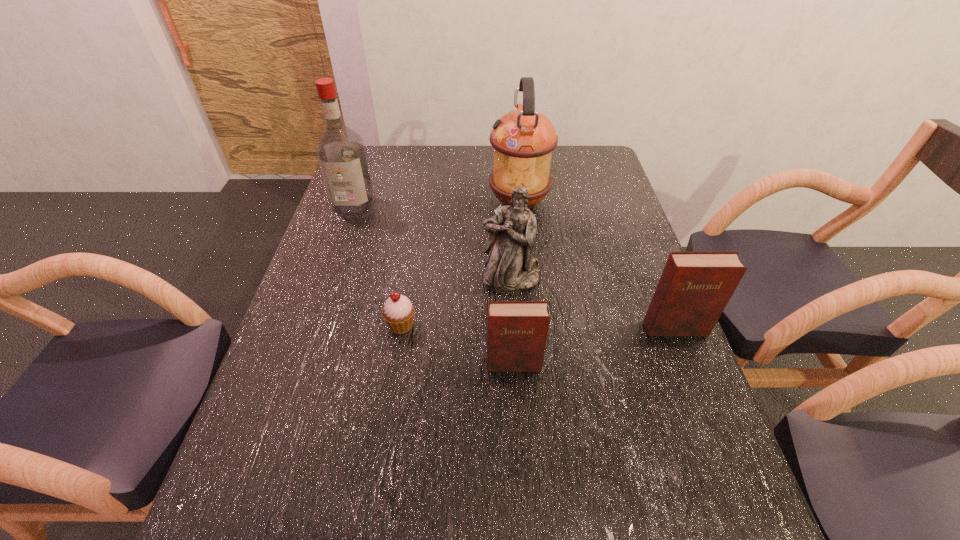
Locate an element on the screen. The image size is (960, 540). the nearer diary is located at coordinates (517, 331).

The image size is (960, 540). I want to click on the fifth tallest object, so click(517, 331).

The height and width of the screenshot is (540, 960). I want to click on the right diary, so click(695, 287).

Locate an element on the screen. the third shortest object is located at coordinates (695, 287).

At what (x,y) coordinates should I click in order to perform the action: click on oil lamp. Please return your answer as a coordinate pair (x, y). This screenshot has width=960, height=540. Looking at the image, I should click on (523, 140).

Identify the location of the fifth object from right to left. (398, 312).

Locate an element on the screen. Image resolution: width=960 pixels, height=540 pixels. the shortest object is located at coordinates (398, 312).

You are a GUI agent. You are given a task and a screenshot of the screen. Output one action in this format:
    pyautogui.click(x=<x>, y=<y>)
    Task: Click on the third farthest object
    This screenshot has width=960, height=540.
    Given the screenshot: What is the action you would take?
    pyautogui.click(x=509, y=267)

Image resolution: width=960 pixels, height=540 pixels. I want to click on the fourth shortest object, so click(x=509, y=267).

Locate an element on the screen. The width and height of the screenshot is (960, 540). liquor is located at coordinates (340, 151).